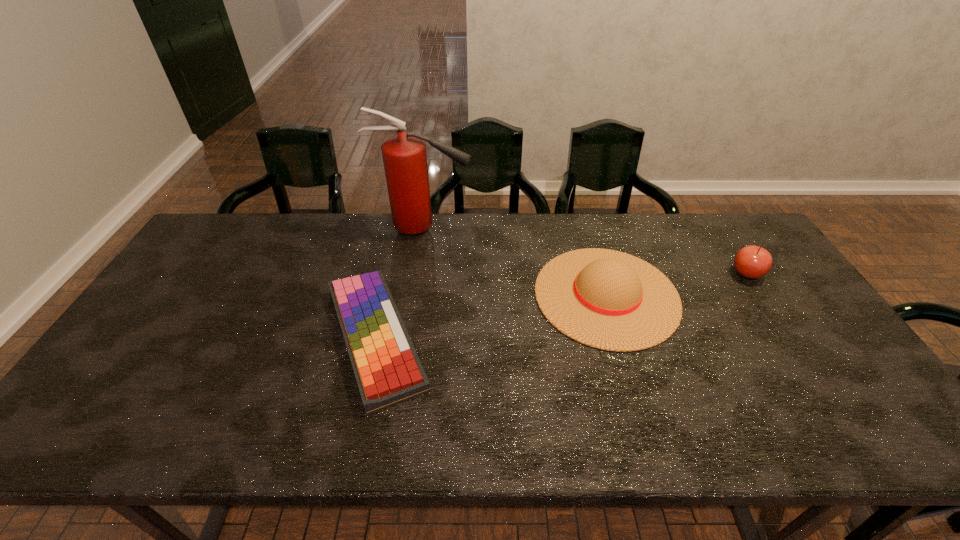
Locate an element on the screen. The image size is (960, 540). free space that is in between the third object from left to right and the apple is located at coordinates (677, 284).

Locate an element on the screen. free space between the rightmost object and the bonnet is located at coordinates (677, 284).

Find the location of a particular element. free space between the computer keyboard and the tallest object is located at coordinates point(399,282).

The height and width of the screenshot is (540, 960). In order to click on vacant area that lies between the third object from left to right and the shortest object in this screenshot , I will do `click(491, 316)`.

Choose which object is the second nearest neighbor to the rightmost object. Please provide its 2D coordinates. Your answer should be formatted as a tuple, i.e. [(x, y)], where the tuple contains the x and y coordinates of a point satisfying the conditions above.

[(404, 156)]

The width and height of the screenshot is (960, 540). In order to click on object that can be found as the second closest to the bonnet in this screenshot , I will do `click(404, 156)`.

Where is `free spot that satisfies the following two spatial constraints: 1. on the back side of the bonnet; 2. at the nozzle of the fire extinguisher`? Image resolution: width=960 pixels, height=540 pixels. free spot that satisfies the following two spatial constraints: 1. on the back side of the bonnet; 2. at the nozzle of the fire extinguisher is located at coordinates (587, 228).

At what (x,y) coordinates should I click in order to perform the action: click on free location that satisfies the following two spatial constraints: 1. at the nozzle of the second object from right to left; 2. on the left side of the tallest object. Please return your answer as a coordinate pair (x, y). Image resolution: width=960 pixels, height=540 pixels. Looking at the image, I should click on (414, 295).

Where is `vacant position in the image that satisfies the following two spatial constraints: 1. at the nozzle of the farthest object; 2. on the left side of the apple`? The height and width of the screenshot is (540, 960). vacant position in the image that satisfies the following two spatial constraints: 1. at the nozzle of the farthest object; 2. on the left side of the apple is located at coordinates (417, 273).

This screenshot has width=960, height=540. In order to click on free space that satisfies the following two spatial constraints: 1. on the back side of the rightmost object; 2. on the left side of the third object from left to right in this screenshot , I will do `click(600, 273)`.